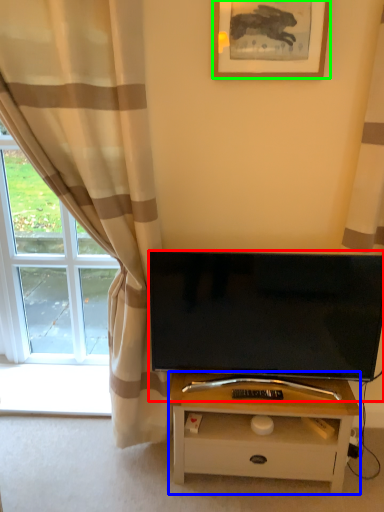
Question: Considering the real-world distances, which object is closest to television (highlighted by a red box)? table (highlighted by a blue box) or picture frame (highlighted by a green box).

Choices:
 (A) table
 (B) picture frame

Answer: (A)